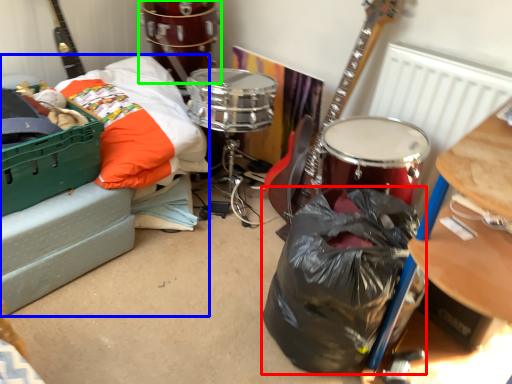
Question: Which object is the closest to the garbage (highlighted by a red box)? Choose among these: couch (highlighted by a blue box) or drum (highlighted by a green box).

Choices:
 (A) couch
 (B) drum

Answer: (A)